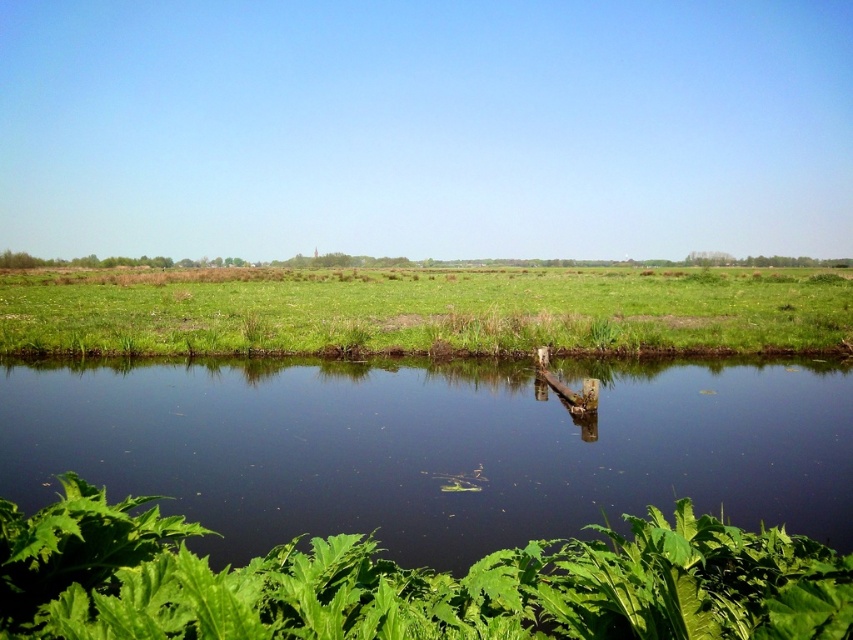
Does point (210, 628) come farther from viewer compared to point (805, 296)?

No.

Does point (401, 589) come farther from viewer compared to point (376, 312)?

No, it is not.

The height and width of the screenshot is (640, 853). Find the location of `green leafy plant at lower center`. green leafy plant at lower center is located at coordinates (409, 582).

Consider the image. Who is more forward, (x=15, y=410) or (x=805, y=296)?

Point (x=15, y=410) is in front.

Between green leafy plants at lower center and green grass at center, which one has more height?

With more height is green grass at center.

Is point (398, 540) positioned behind point (480, 307)?

No, it is in front of (480, 307).

Where is `green leafy plants at lower center`? This screenshot has height=640, width=853. green leafy plants at lower center is located at coordinates (433, 449).

Can you confirm if green leafy plants at lower center is shorter than green leafy plant at lower center?

In fact, green leafy plants at lower center may be taller than green leafy plant at lower center.

The height and width of the screenshot is (640, 853). Describe the element at coordinates (433, 449) in the screenshot. I see `green leafy plants at lower center` at that location.

Image resolution: width=853 pixels, height=640 pixels. Describe the element at coordinates (433, 449) in the screenshot. I see `green leafy plants at lower center` at that location.

This screenshot has height=640, width=853. What are the coordinates of `green leafy plants at lower center` in the screenshot? It's located at (433, 449).